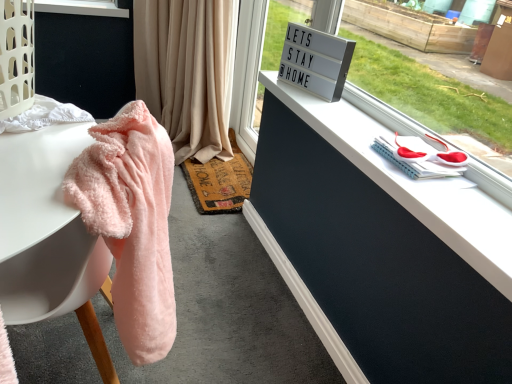
Question: From the image's perspective, is beige fabric curtain at upper center beneath fluffy pink towel at left?

Choices:
 (A) yes
 (B) no

Answer: (B)

Question: Is beige fabric curtain at upper center outside fluffy pink towel at left?

Choices:
 (A) yes
 (B) no

Answer: (A)

Question: Is beige fabric curtain at upper center facing towards fluffy pink towel at left?

Choices:
 (A) yes
 (B) no

Answer: (B)

Question: Is beige fabric curtain at upper center facing away from fluffy pink towel at left?

Choices:
 (A) yes
 (B) no

Answer: (B)

Question: From the image's perspective, would you say beige fabric curtain at upper center is positioned over fluffy pink towel at left?

Choices:
 (A) no
 (B) yes

Answer: (B)

Question: Does point pos(152,92) appear closer or farther from the camera than point pos(425,370)?

Choices:
 (A) closer
 (B) farther

Answer: (B)

Question: Is beige fabric curtain at upper center situated inside white matte dresser at upper right or outside?

Choices:
 (A) inside
 (B) outside

Answer: (B)

Question: From their relative heights in the image, would you say beige fabric curtain at upper center is taller or shorter than white matte dresser at upper right?

Choices:
 (A) tall
 (B) short

Answer: (A)

Question: Looking at the image, does beige fabric curtain at upper center seem bigger or smaller compared to white matte dresser at upper right?

Choices:
 (A) big
 (B) small

Answer: (A)

Question: Is point (62, 150) closer or farther from the camera than point (223, 195)?

Choices:
 (A) closer
 (B) farther

Answer: (A)

Question: Would you say fluffy pink towel at left is inside or outside rustic woven mat at center?

Choices:
 (A) outside
 (B) inside

Answer: (A)

Question: From a real-world perspective, is fluffy pink towel at left above or below rustic woven mat at center?

Choices:
 (A) below
 (B) above

Answer: (B)

Question: Relative to rustic woven mat at center, is fluffy pink towel at left in front or behind?

Choices:
 (A) behind
 (B) front

Answer: (B)

Question: In the image, is rustic woven mat at center on the left side or the right side of white matte dresser at upper right?

Choices:
 (A) right
 (B) left

Answer: (B)

Question: From the image's perspective, relative to white matte dresser at upper right, is rustic woven mat at center above or below?

Choices:
 (A) above
 (B) below

Answer: (B)